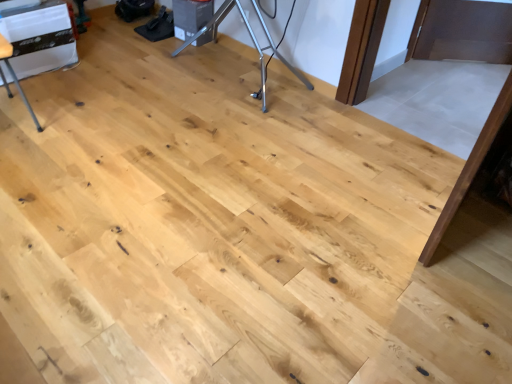
Question: Can you confirm if silver metallic tripod at center is thinner than matte white appliance at left?

Choices:
 (A) yes
 (B) no

Answer: (A)

Question: Does silver metallic tripod at center come behind matte white appliance at left?

Choices:
 (A) no
 (B) yes

Answer: (B)

Question: Is silver metallic tripod at center positioned with its back to matte white appliance at left?

Choices:
 (A) yes
 (B) no

Answer: (B)

Question: From the image's perspective, does silver metallic tripod at center appear lower than matte white appliance at left?

Choices:
 (A) no
 (B) yes

Answer: (A)

Question: Is silver metallic tripod at center aimed at matte white appliance at left?

Choices:
 (A) no
 (B) yes

Answer: (B)

Question: Looking at their shapes, would you say matte white appliance at left is wider or thinner than white plastic table at upper left?

Choices:
 (A) thin
 (B) wide

Answer: (A)

Question: Is matte white appliance at left taller or shorter than white plastic table at upper left?

Choices:
 (A) tall
 (B) short

Answer: (A)

Question: Choose the correct answer: Is matte white appliance at left inside white plastic table at upper left or outside it?

Choices:
 (A) outside
 (B) inside

Answer: (A)

Question: Is matte white appliance at left in front of or behind white plastic table at upper left in the image?

Choices:
 (A) behind
 (B) front

Answer: (B)

Question: Which is correct: white plastic table at upper left is inside matte white appliance at left, or outside of it?

Choices:
 (A) inside
 (B) outside

Answer: (B)

Question: From a real-world perspective, is white plastic table at upper left above or below matte white appliance at left?

Choices:
 (A) above
 (B) below

Answer: (B)

Question: Based on their sizes in the image, would you say white plastic table at upper left is bigger or smaller than matte white appliance at left?

Choices:
 (A) small
 (B) big

Answer: (B)

Question: Visually, is white plastic table at upper left positioned to the left or to the right of matte white appliance at left?

Choices:
 (A) right
 (B) left

Answer: (B)

Question: Does point (6, 56) appear closer or farther from the camera than point (177, 51)?

Choices:
 (A) closer
 (B) farther

Answer: (A)

Question: From a real-world perspective, relative to silver metallic tripod at center, is matte white appliance at left vertically above or below?

Choices:
 (A) above
 (B) below

Answer: (A)